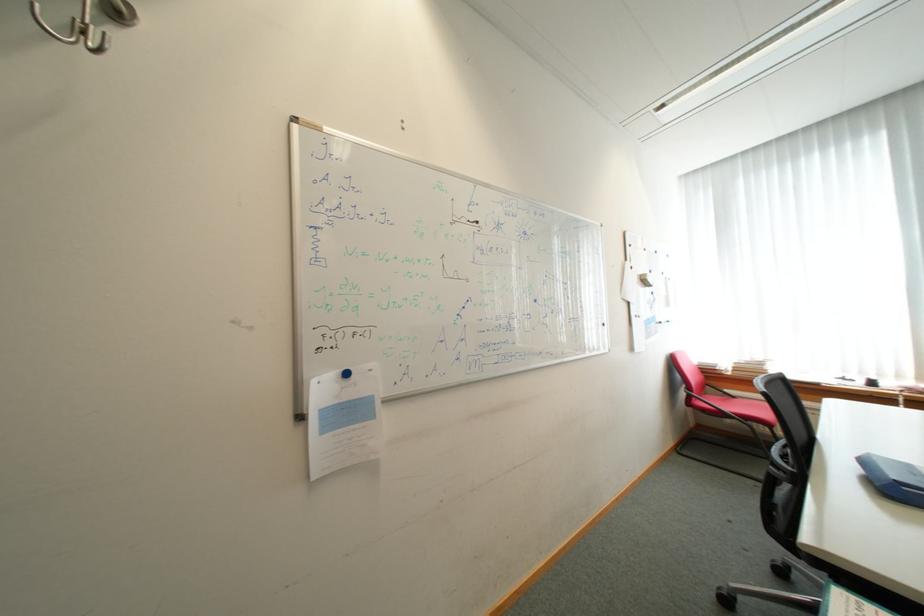
The image size is (924, 616). What do you see at coordinates (346, 373) in the screenshot?
I see `the blue circular magnet` at bounding box center [346, 373].